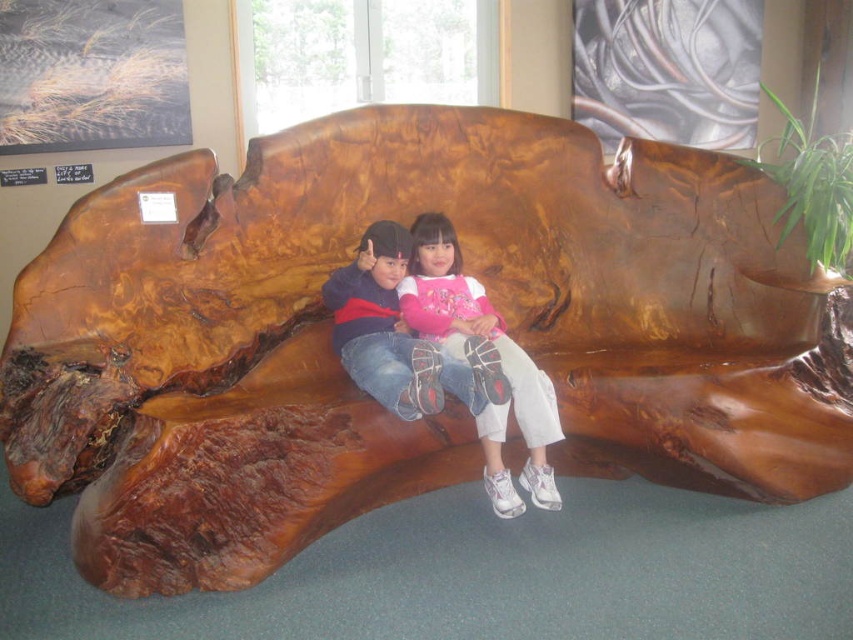
You are an interior designer assessing the layout of a gallery space. You notice the matte pink shirt at center and the matte brown wooden bench at center. Which object has a greater height in this scene?

The matte pink shirt at center is taller than the matte brown wooden bench at center.

You are standing at point (489, 378) and want to walk to point (427, 221). Which direction should you move?

To reach point (427, 221) from point (489, 378), you should move towards the direction where the X coordinate decreases and the Y coordinate decreases slightly, as point (427, 221) is located behind point (489, 378).